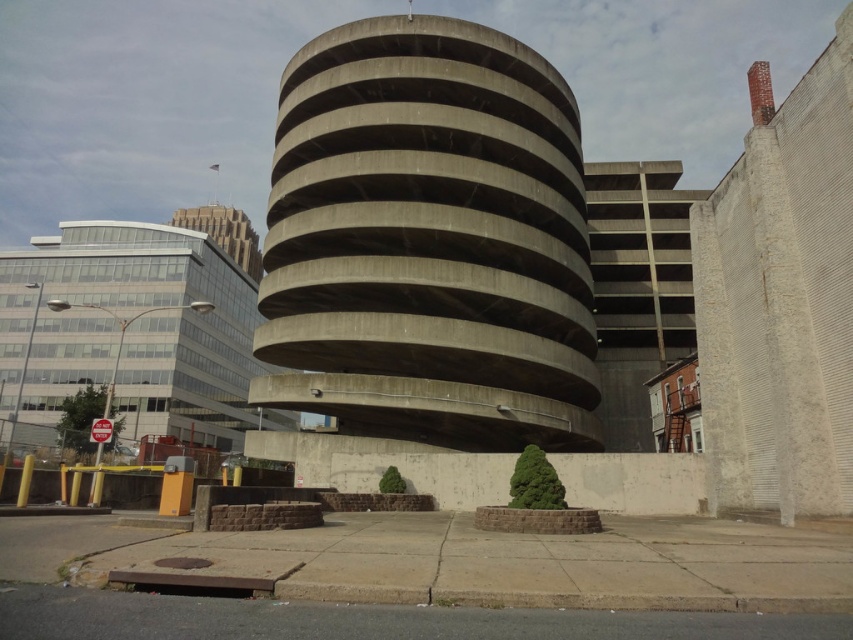
Question: Does concrete parking garage at right have a smaller size compared to glass/metal skyscraper at upper left?

Choices:
 (A) no
 (B) yes

Answer: (B)

Question: Which point is farther from the camera taking this photo?

Choices:
 (A) (260, 397)
 (B) (175, 216)

Answer: (B)

Question: Is concrete parking garage at right wider than glass/metal skyscraper at upper left?

Choices:
 (A) no
 (B) yes

Answer: (A)

Question: Which object is closer to the camera taking this photo?

Choices:
 (A) concrete building at left
 (B) glass/metal skyscraper at upper left
 (C) concrete at center
 (D) white brick wall at right

Answer: (D)

Question: Which object is closer to the camera taking this photo?

Choices:
 (A) concrete at center
 (B) concrete parking garage at right
 (C) white brick wall at right
 (D) concrete building at left

Answer: (C)

Question: Observing the image, what is the correct spatial positioning of concrete building at left in reference to glass/metal skyscraper at upper left?

Choices:
 (A) left
 (B) right

Answer: (B)